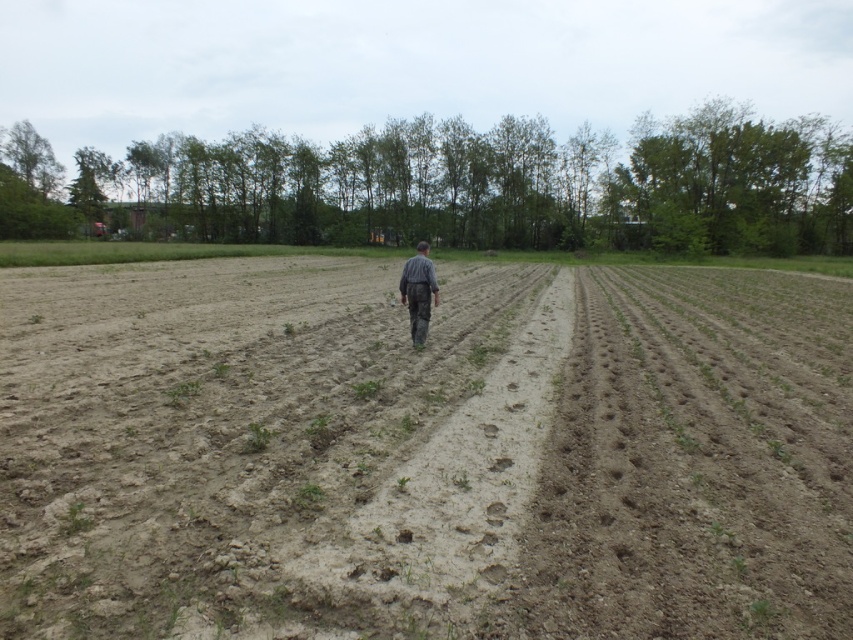
Question: Which point is closer to the camera?

Choices:
 (A) gray striped shirt at center
 (B) brown soil at center

Answer: (B)

Question: Where is brown soil at center located in relation to gray striped shirt at center in the image?

Choices:
 (A) above
 (B) below

Answer: (B)

Question: Is brown soil at center to the right of gray striped shirt at center from the viewer's perspective?

Choices:
 (A) no
 (B) yes

Answer: (A)

Question: Which point is farther to the camera?

Choices:
 (A) (436, 304)
 (B) (664, 282)

Answer: (B)

Question: Which point is closer to the camera taking this photo?

Choices:
 (A) (428, 278)
 (B) (393, 404)

Answer: (B)

Question: Does brown soil at center appear on the right side of gray striped shirt at center?

Choices:
 (A) no
 (B) yes

Answer: (A)